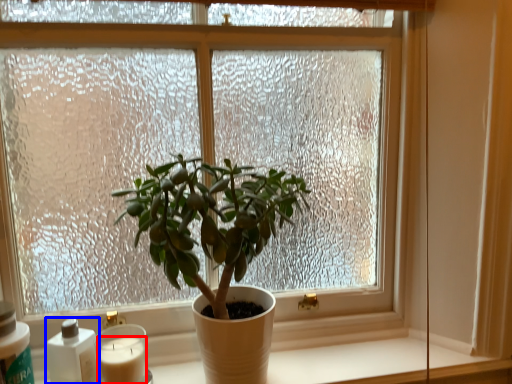
Question: Among these objects, which one is nearest to the camera, candle (highlighted by a red box) or bottle (highlighted by a blue box)?

Choices:
 (A) candle
 (B) bottle

Answer: (B)